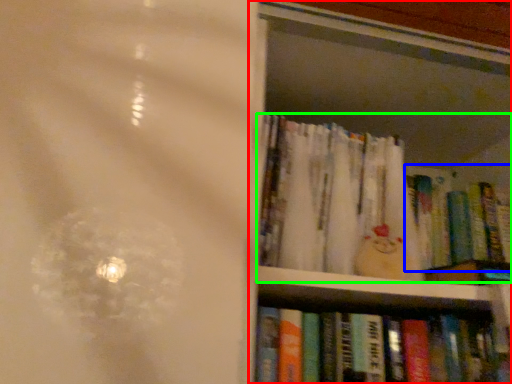
Question: Which object is the closest to the bookcase (highlighted by a red box)? Choose among these: book (highlighted by a blue box) or book (highlighted by a green box).

Choices:
 (A) book
 (B) book

Answer: (B)